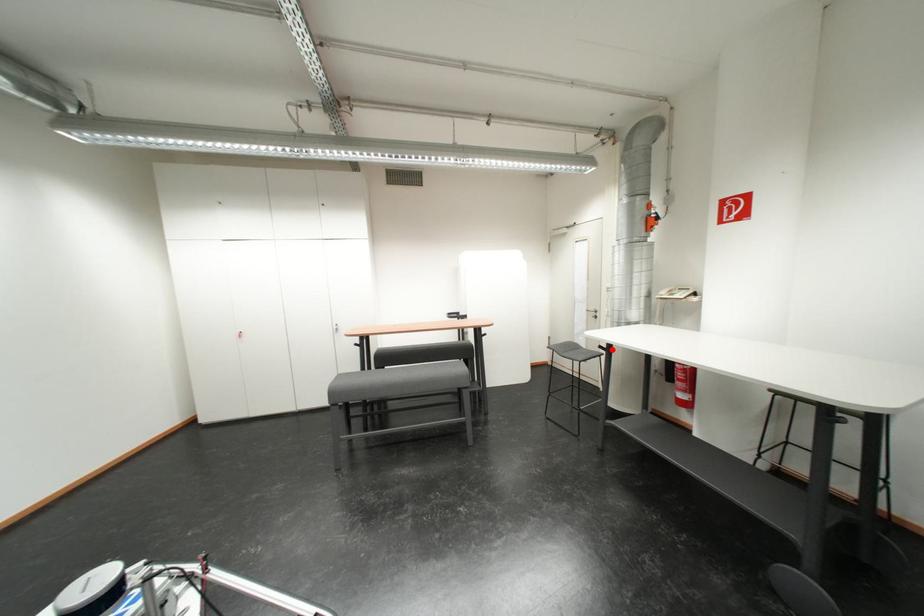
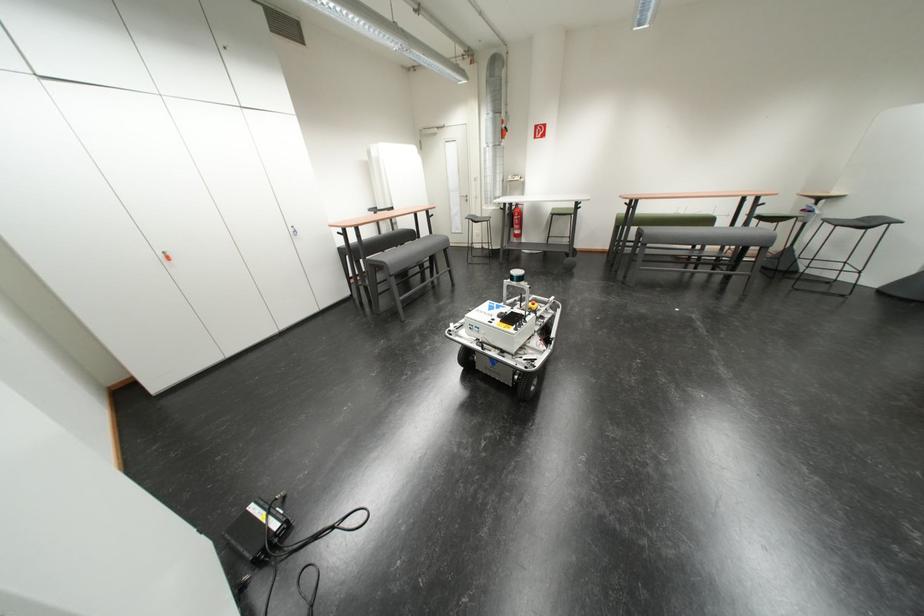
Where in the second image is the point corresponding to the highlighted location from the first image?

(512, 211)